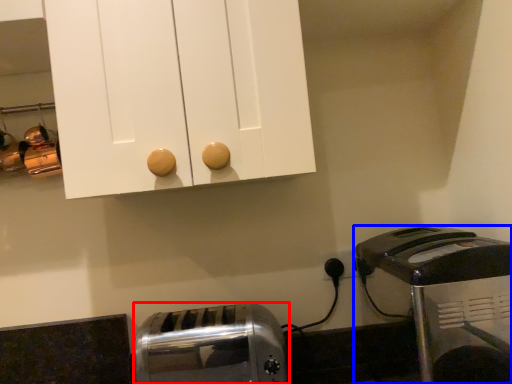
Question: Among these objects, which one is farthest to the camera, toaster (highlighted by a red box) or toaster (highlighted by a blue box)?

Choices:
 (A) toaster
 (B) toaster

Answer: (A)